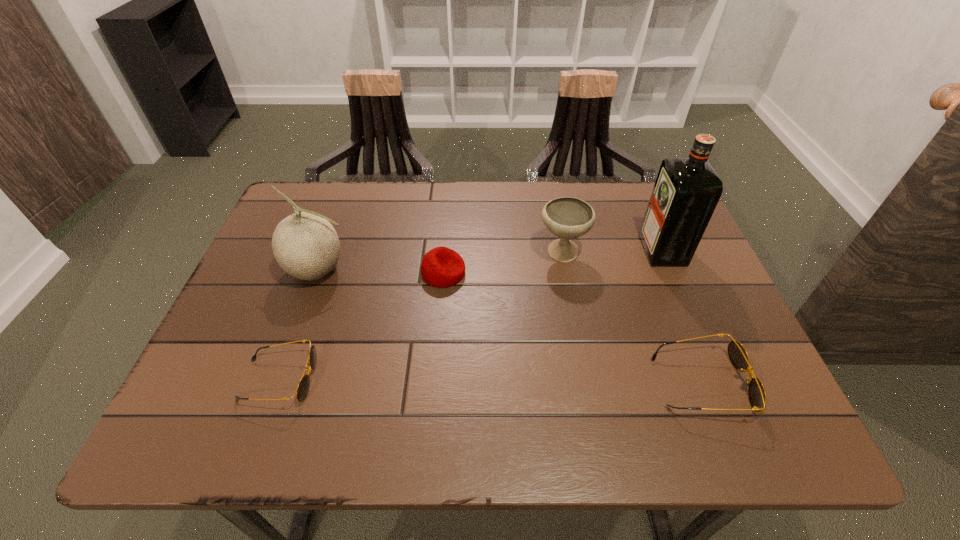
The image size is (960, 540). I want to click on free space located on the front label of the liquor, so click(x=533, y=251).

Where is `blank space located on the front label of the liquor`? blank space located on the front label of the liquor is located at coordinates (537, 251).

Image resolution: width=960 pixels, height=540 pixels. Identify the location of vacant space located 0.340m on the front of the chalice. (588, 393).

Image resolution: width=960 pixels, height=540 pixels. Find the location of `vacant region located on the seat area of the beanbag`. vacant region located on the seat area of the beanbag is located at coordinates (582, 273).

Identify the location of free space located on the back of the second tallest object. (342, 206).

The image size is (960, 540). In order to click on sunglasses positioned at the left edge in this screenshot , I will do `click(302, 390)`.

In order to click on cantaloup that is at the left edge in this screenshot , I will do `click(305, 245)`.

Identify the location of sunglasses that is at the right edge. (737, 354).

At what (x,y) coordinates should I click in order to perform the action: click on liquor present at the right edge. Please return your answer as a coordinate pair (x, y). This screenshot has width=960, height=540. Looking at the image, I should click on (686, 192).

Where is `object that is at the near left corner`? Image resolution: width=960 pixels, height=540 pixels. object that is at the near left corner is located at coordinates (302, 390).